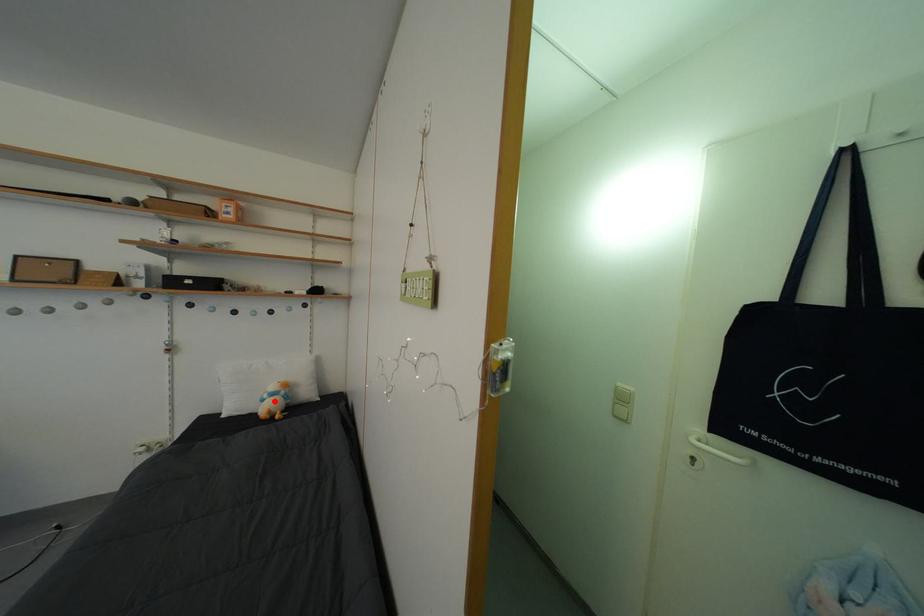
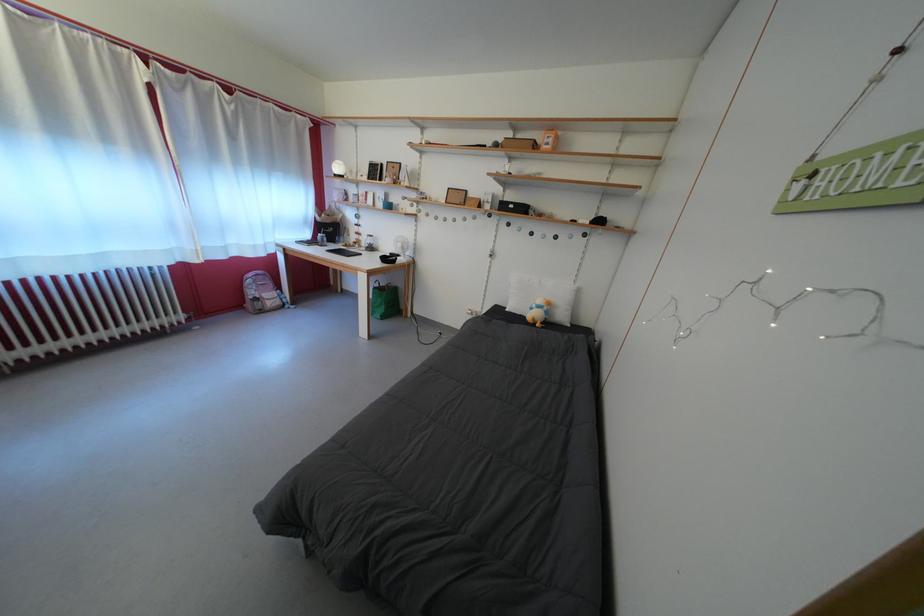
The point at the highlighted location is marked in the first image. Where is the corresponding point in the second image?

(542, 312)